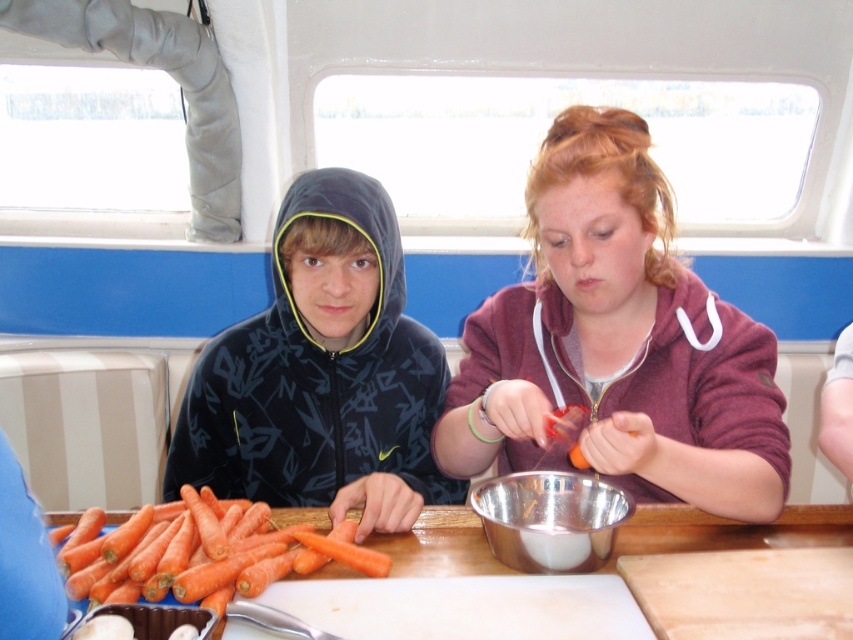
You are a chef standing behind the orange wood table at center and want to hand a recipe card to the person wearing the maroon fleece at center. Can you reach them without moving your position?

The maroon fleece at center is closer to the viewer than the orange wood table at center, so the chef can reach them without moving.

You are a chef preparing a meal in a boat cabin. You need to place a large cutting board on the table. Given the orange wood table at center and the orange matte carrots at lower left, which object can accommodate the cutting board?

The orange wood table at center is larger in size than the orange matte carrots at lower left, so the cutting board can be placed on the orange wood table at center.